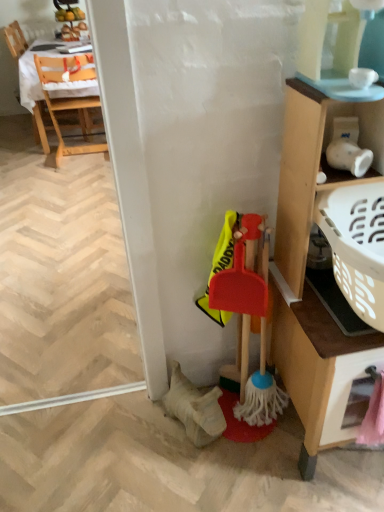
Question: Based on their positions, is wooden cabinet at right located to the left or right of rubberized plastic broom at lower right?

Choices:
 (A) left
 (B) right

Answer: (B)

Question: Is point (329, 389) positioned closer to the camera than point (244, 350)?

Choices:
 (A) farther
 (B) closer

Answer: (B)

Question: Considering the real-world distances, which object is closest to the pink plastic drawer at lower right?

Choices:
 (A) wooden chair at left, the second chair viewed from the left
 (B) transparent plastic screen door at lower right
 (C) wooden cabinet at right
 (D) wooden chair at upper left, acting as the 1th chair starting from the left
 (E) rubberized plastic broom at lower right

Answer: (C)

Question: Estimate the real-world distances between objects in this image. Which object is closer to the wooden chair at upper left, acting as the 1th chair starting from the left?

Choices:
 (A) wooden cabinet at right
 (B) wooden chair at left, the 1th chair positioned from the right
 (C) transparent plastic screen door at lower right
 (D) rubberized plastic broom at lower right
 (E) pink plastic drawer at lower right

Answer: (B)